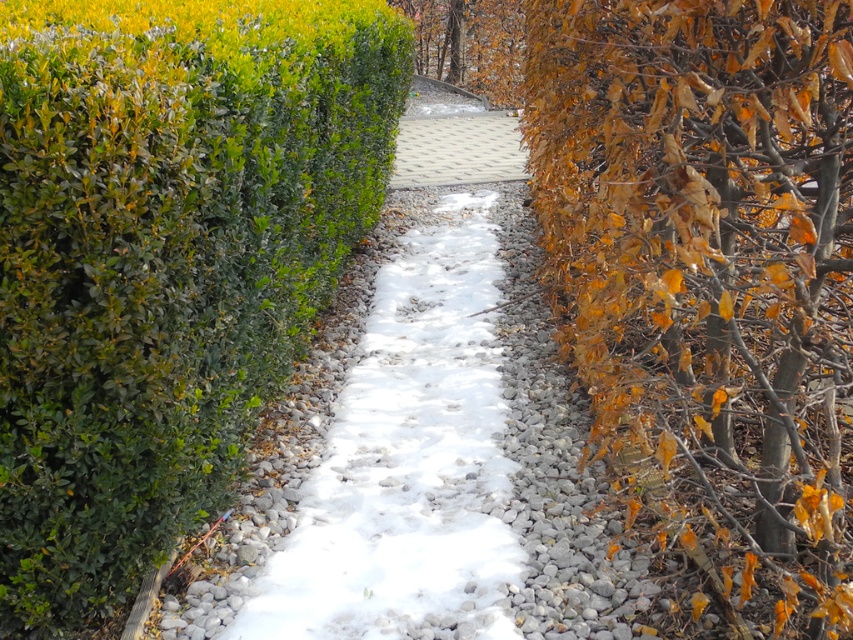
You are standing at the center of the pathway and want to reach the green leafy bush at upper left. Which direction should you move in to get closer to it?

The green leafy bush at upper left is located at point (164, 260), so you should move towards the upper left direction to reach it.